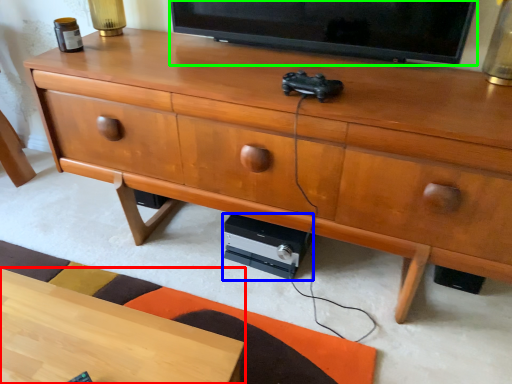
Question: Based on their relative distances, which object is farther from desk (highlighted by a red box)? Choose from stereo (highlighted by a blue box) and television (highlighted by a green box).

Choices:
 (A) stereo
 (B) television

Answer: (B)